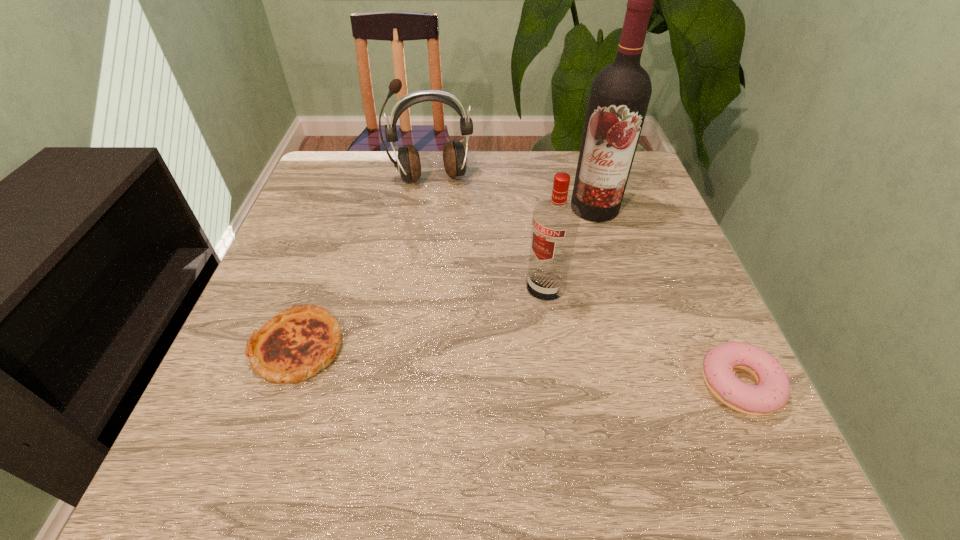
Locate an element on the screen. The width and height of the screenshot is (960, 540). free space between the leftmost object and the farthest object is located at coordinates (365, 262).

You are a GUI agent. You are given a task and a screenshot of the screen. Output one action in this format:
    pyautogui.click(x=<x>, y=<y>)
    Task: Click on the vacant space in between the second object from right to left and the fourth object from right to left
    
    Given the screenshot: What is the action you would take?
    pyautogui.click(x=513, y=193)

Where is `vacant area that lies between the quiche and the wine bottle`? The width and height of the screenshot is (960, 540). vacant area that lies between the quiche and the wine bottle is located at coordinates (446, 278).

This screenshot has width=960, height=540. I want to click on vacant space in between the fourth object from right to left and the second farthest object, so click(x=513, y=193).

The height and width of the screenshot is (540, 960). Identify the location of free space between the earphone and the second farthest object. (513, 193).

Where is `empty space that is in between the second farthest object and the doughnut`? This screenshot has width=960, height=540. empty space that is in between the second farthest object and the doughnut is located at coordinates (666, 296).

I want to click on the fourth closest object to the third farthest object, so click(294, 345).

Locate which object ranks in proximity to the third nearest object. Please provide its 2D coordinates. Your answer should be formatted as a tuple, i.e. [(x, y)], where the tuple contains the x and y coordinates of a point satisfying the conditions above.

[(619, 97)]

I want to click on free space that satisfies the following two spatial constraints: 1. on the front side of the tallest object; 2. on the left side of the doughnut, so click(647, 384).